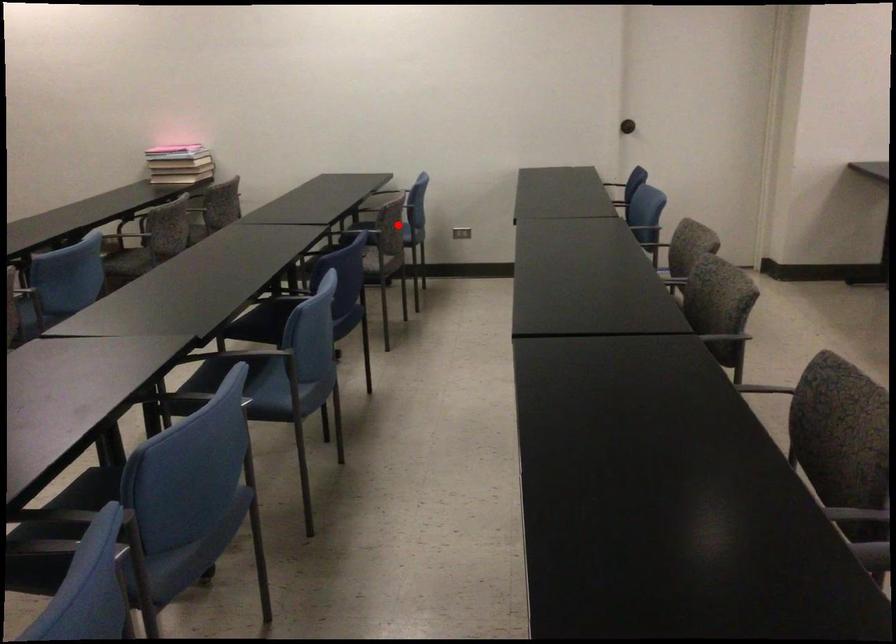
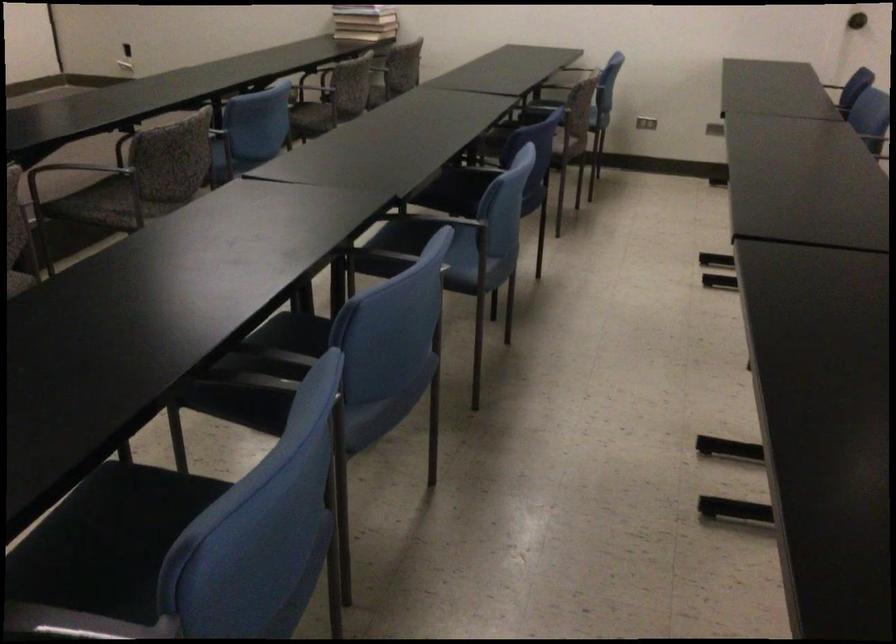
Question: I am providing you with two images of the same scene from different viewpoints. A red point is marked on the first image. At the location where the point appears in image 1, is it still visible in image 2?

Choices:
 (A) Yes
 (B) No

Answer: (B)